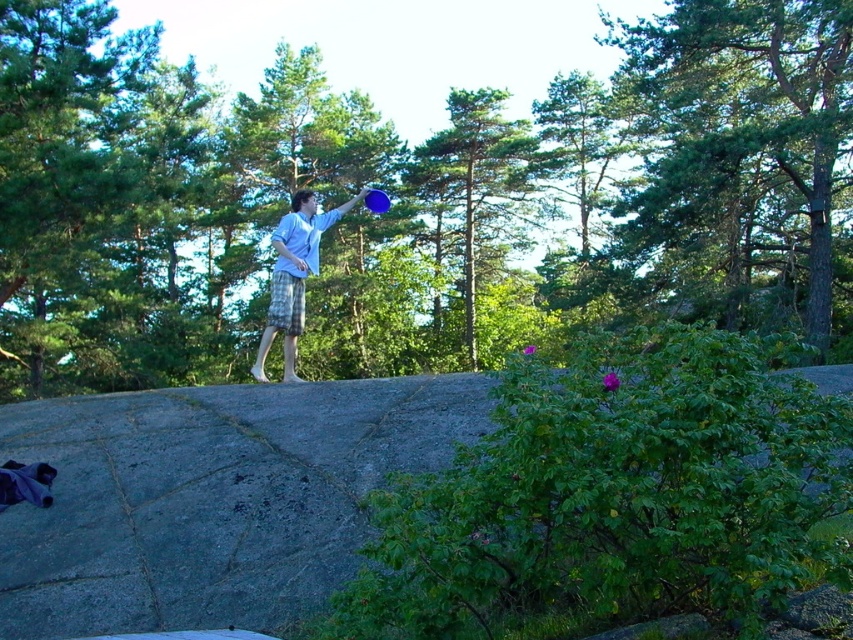
Does green leafy tree at upper right have a lesser width compared to blue plastic frisbee at upper center?

Incorrect, green leafy tree at upper right's width is not less than blue plastic frisbee at upper center's.

Who is positioned more to the right, green leafy tree at upper right or blue plastic frisbee at upper center?

From the viewer's perspective, green leafy tree at upper right appears more on the right side.

Who is more distant from viewer, (x=850, y=28) or (x=373, y=193)?

Positioned behind is point (x=850, y=28).

Where is `green leafy tree at upper right`? green leafy tree at upper right is located at coordinates (744, 116).

The image size is (853, 640). Find the location of `green leafy bush at center`. green leafy bush at center is located at coordinates (x=415, y=198).

Can you confirm if green leafy bush at center is positioned to the right of green leafy tree at upper right?

In fact, green leafy bush at center is to the left of green leafy tree at upper right.

You are a GUI agent. You are given a task and a screenshot of the screen. Output one action in this format:
    pyautogui.click(x=<x>, y=<y>)
    Task: Click on the green leafy bush at center
    The image size is (853, 640).
    Given the screenshot: What is the action you would take?
    pyautogui.click(x=415, y=198)

Where is `green leafy bush at center`? This screenshot has width=853, height=640. green leafy bush at center is located at coordinates (415, 198).

Is point (692, 227) farther from viewer compared to point (386, 211)?

Yes, it is.

Who is more forward, (410, 369) or (367, 192)?

Positioned in front is point (367, 192).

Who is more forward, (606, 161) or (379, 196)?

Point (379, 196) is in front.

Locate an element on the screen. The width and height of the screenshot is (853, 640). green leafy bush at center is located at coordinates (415, 198).